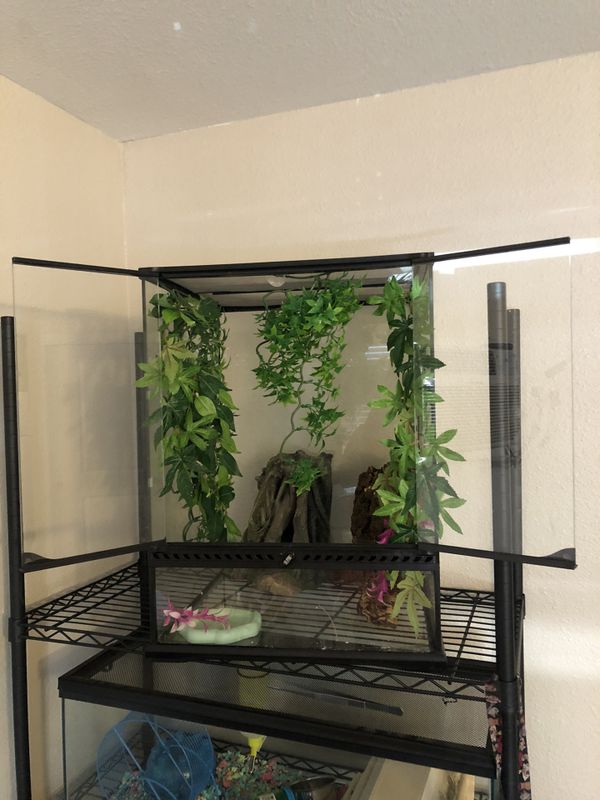
At what (x,y) coordinates should I click in order to perform the action: click on lock. Please return your answer as a coordinate pair (x, y). The height and width of the screenshot is (800, 600). Looking at the image, I should click on (288, 560).